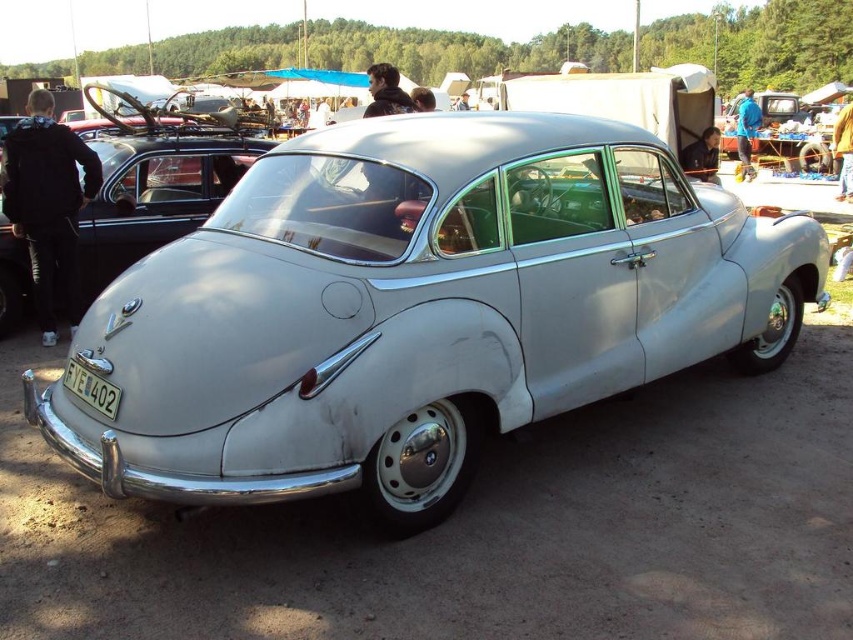
You are standing in front of the satin silver car at center. Based on the coordinates provided, can you determine if the car is positioned closer to the top or bottom of the image?

The satin silver car at center is located at point coordinates with a y value of 0.491, which is very close to the center of the image vertically. Since 0.491 is just slightly below the midpoint of 0.5, it is positioned very near the center but slightly closer to the bottom of the image.

You are standing in front of a vintage car exhibition. A guide tells you that there is a satin silver car at center marked by a point at coordinate (418,308). You want to locate it using the coordinates. Where should you look first?

The point at coordinate (418,308) indicates the location of the satin silver car at center, so you should look at the center to locate it.

You are a photographer wanting to capture the satin silver car at center and the white plastic license plate at lower center in a single shot. Can you position yourself so that both objects are visible in the frame without moving either object?

The satin silver car at center is located above the white plastic license plate at lower center, so yes, you can position yourself to include both in the frame since they are vertically aligned with the car above the license plate.